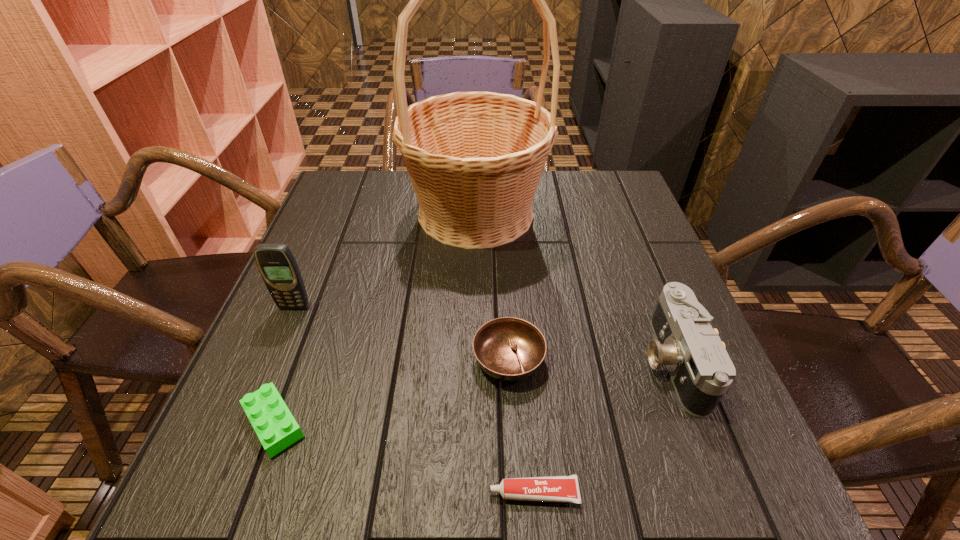
Locate an element on the screen. The height and width of the screenshot is (540, 960). free space at the far left corner is located at coordinates (384, 178).

The height and width of the screenshot is (540, 960). Find the location of `vacant area that lies between the Lego and the cellular telephone`. vacant area that lies between the Lego and the cellular telephone is located at coordinates (284, 365).

Where is `vacant area between the basket and the Lego`? This screenshot has width=960, height=540. vacant area between the basket and the Lego is located at coordinates pos(374,318).

Locate an element on the screen. The height and width of the screenshot is (540, 960). vacant space that is in between the second tallest object and the shortest object is located at coordinates (414, 400).

Find the location of `unoccupied position between the nearest object and the soup bowl`. unoccupied position between the nearest object and the soup bowl is located at coordinates (521, 426).

Image resolution: width=960 pixels, height=540 pixels. What are the coordinates of `vacant space that's between the rightmost object and the toothpaste` in the screenshot? It's located at (603, 427).

Identify the location of vacant area between the basket and the soup bowl. (492, 286).

This screenshot has height=540, width=960. Find the location of `empty location between the second farthest object and the farthest object`. empty location between the second farthest object and the farthest object is located at coordinates (385, 260).

Where is `free space that is in between the fifth tallest object and the camera`? free space that is in between the fifth tallest object and the camera is located at coordinates (473, 392).

Locate an element on the screen. Image resolution: width=960 pixels, height=540 pixels. empty space that is in between the basket and the Lego is located at coordinates (374, 318).